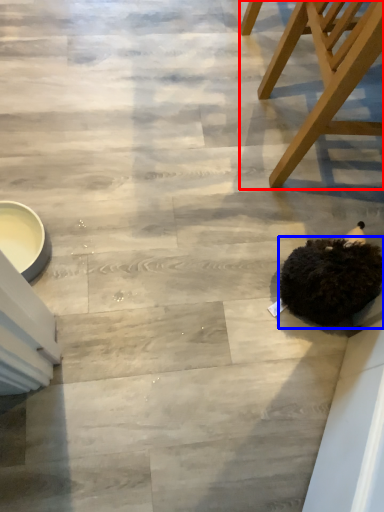
Question: Which of the following is the farthest to the observer, chair (highlighted by a red box) or animal (highlighted by a blue box)?

Choices:
 (A) chair
 (B) animal

Answer: (B)